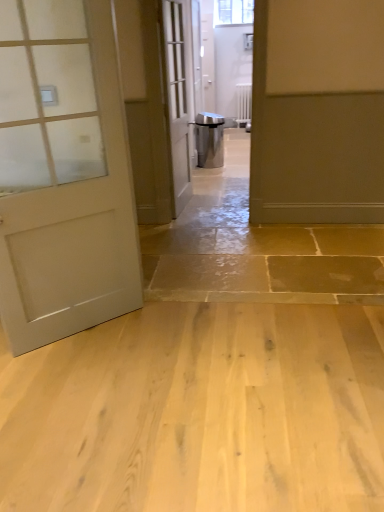
Question: Considering the relative sizes of matte white door at left, positioned as the third door in right-to-left order, and white glass door at center, which appears as the 2th door when viewed from the left, in the image provided, is matte white door at left, positioned as the third door in right-to-left order, wider than white glass door at center, which appears as the 2th door when viewed from the left,?

Choices:
 (A) yes
 (B) no

Answer: (B)

Question: Is matte white door at left, positioned as the third door in right-to-left order, taller than white glass door at center, the 2th door when ordered from back to front?

Choices:
 (A) no
 (B) yes

Answer: (A)

Question: Is white glass door at center, the 2th door when ordered from back to front, surrounded by matte white door at left, which is the 1th door from left to right?

Choices:
 (A) yes
 (B) no

Answer: (B)

Question: Does matte white door at left, which is the 1th door from left to right, turn towards white glass door at center, arranged as the 2th door when viewed from the right?

Choices:
 (A) yes
 (B) no

Answer: (B)

Question: Considering the relative positions of matte white door at left, positioned as the third door in right-to-left order, and white glass door at center, the second door in the front-to-back sequence, in the image provided, is matte white door at left, positioned as the third door in right-to-left order, in front of white glass door at center, the second door in the front-to-back sequence,?

Choices:
 (A) no
 (B) yes

Answer: (B)

Question: Do you think matte gray door at right, which is the first door from back to front, is within matte white door at left, the third door viewed from the back, or outside of it?

Choices:
 (A) inside
 (B) outside

Answer: (B)

Question: Would you say matte gray door at right, the third door when ordered from front to back, is to the left or to the right of matte white door at left, the first door viewed from the front, in the picture?

Choices:
 (A) left
 (B) right

Answer: (B)

Question: From the image's perspective, is matte gray door at right, arranged as the 1th door when viewed from the right, positioned above or below matte white door at left, which is the 1th door from left to right?

Choices:
 (A) above
 (B) below

Answer: (A)

Question: From a real-world perspective, relative to matte white door at left, which is the 1th door from left to right, is matte gray door at right, arranged as the 1th door when viewed from the right, vertically above or below?

Choices:
 (A) above
 (B) below

Answer: (B)

Question: Is white glass door at center, the second door in the front-to-back sequence, in front of or behind light brown wood flooring at center in the image?

Choices:
 (A) behind
 (B) front

Answer: (A)

Question: In terms of width, does white glass door at center, the second door in the front-to-back sequence, look wider or thinner when compared to light brown wood flooring at center?

Choices:
 (A) thin
 (B) wide

Answer: (A)

Question: In terms of size, does white glass door at center, the 2th door when ordered from back to front, appear bigger or smaller than light brown wood flooring at center?

Choices:
 (A) big
 (B) small

Answer: (A)

Question: From the image's perspective, is white glass door at center, which appears as the 2th door when viewed from the left, located above or below light brown wood flooring at center?

Choices:
 (A) above
 (B) below

Answer: (A)

Question: From the image's perspective, is light brown wood flooring at center located above or below clear glass window at upper center?

Choices:
 (A) below
 (B) above

Answer: (A)

Question: Is point (316, 315) positioned closer to the camera than point (236, 0)?

Choices:
 (A) farther
 (B) closer

Answer: (B)